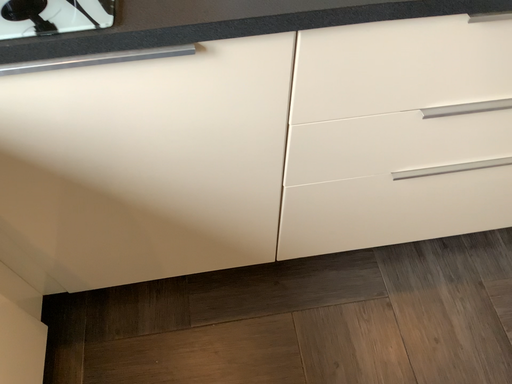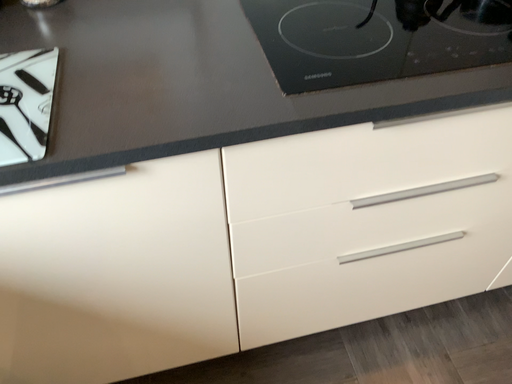
Question: Which way did the camera rotate in the video?

Choices:
 (A) rotated upward
 (B) rotated downward

Answer: (A)